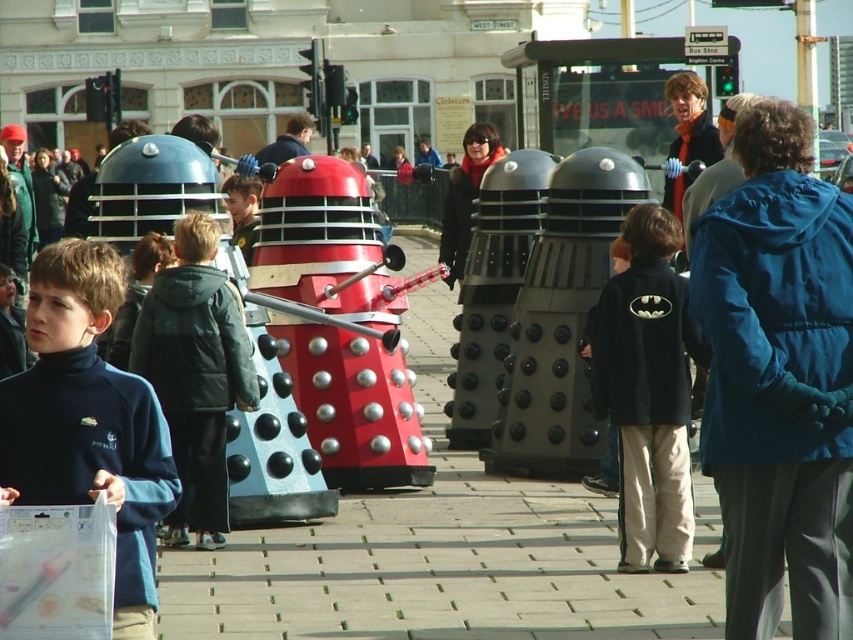
Which is behind, point (648, 228) or point (202, 540)?

The point (648, 228) is more distant.

Which is in front, point (675, 237) or point (199, 406)?

Point (199, 406) is in front.

Which is behind, point (686, 445) or point (173, 336)?

The point (173, 336) is more distant.

Identify the location of navy blue fleece jacket at center. (648, 392).

The height and width of the screenshot is (640, 853). Describe the element at coordinates (88, 420) in the screenshot. I see `blue fleece sweater at lower left` at that location.

Between point (83, 397) and point (189, 387), which one is positioned in front?

Positioned in front is point (83, 397).

Locate an element on the screen. This screenshot has width=853, height=640. blue fleece sweater at lower left is located at coordinates (88, 420).

Who is higher up, blue fleece sweater at lower left or navy blue fleece jacket at center?

blue fleece sweater at lower left is above.

Is blue fleece sweater at lower left to the right of navy blue fleece jacket at center from the viewer's perspective?

No, blue fleece sweater at lower left is not to the right of navy blue fleece jacket at center.

Is point (79, 445) more distant than point (643, 548)?

No, it is in front of (643, 548).

This screenshot has width=853, height=640. I want to click on blue fleece sweater at lower left, so click(88, 420).